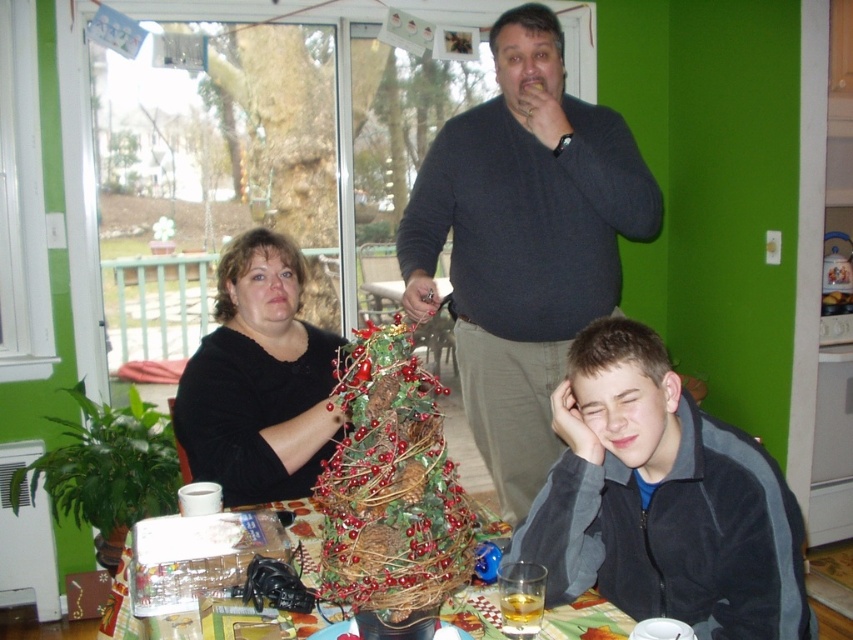
You are a guest at this holiday gathering and want to grab your gray fleece jacket at lower right from the table. If you are standing 1 meter away from the table, can you reach it without moving closer?

The gray fleece jacket at lower right is 1.35 meters away from the viewer. Since you are standing 1 meter away from the table, the jacket is an additional 0.35 meters beyond your current position. Therefore, you would need to move closer to reach it.